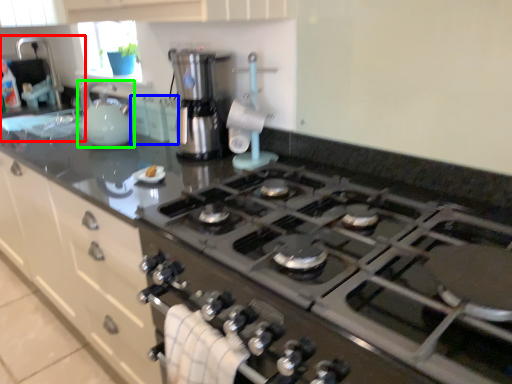
Question: Considering the real-world distances, which object is farthest from sink (highlighted by a red box)? cabinetry (highlighted by a blue box) or kitchen appliance (highlighted by a green box)?

Choices:
 (A) cabinetry
 (B) kitchen appliance

Answer: (A)